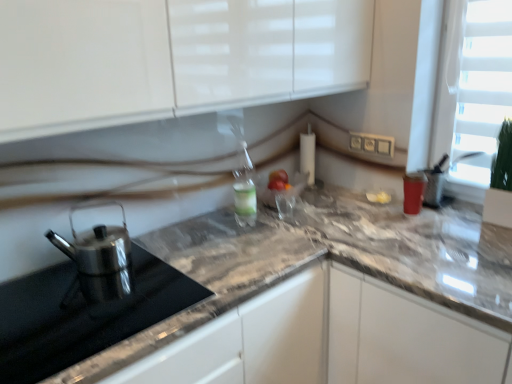
Identify the location of free space in front of polished stainless steel kettle at left. (81, 309).